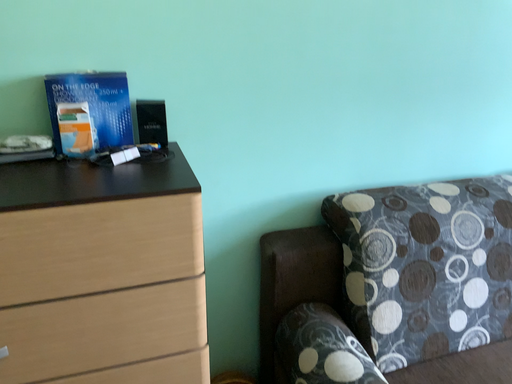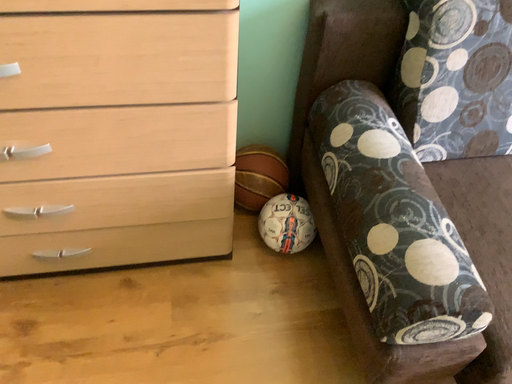
Question: Which way did the camera rotate in the video?

Choices:
 (A) rotated upward
 (B) rotated downward

Answer: (B)